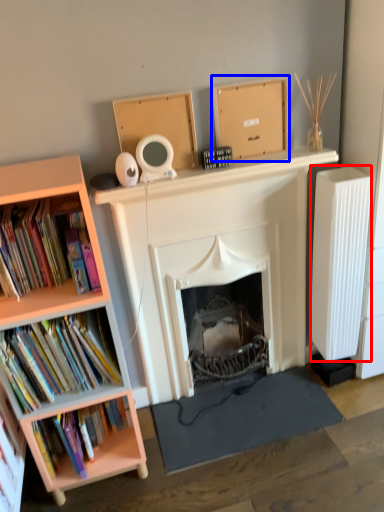
Question: Among these objects, which one is farthest to the camera, radiator (highlighted by a red box) or cardboard box (highlighted by a blue box)?

Choices:
 (A) radiator
 (B) cardboard box

Answer: (A)